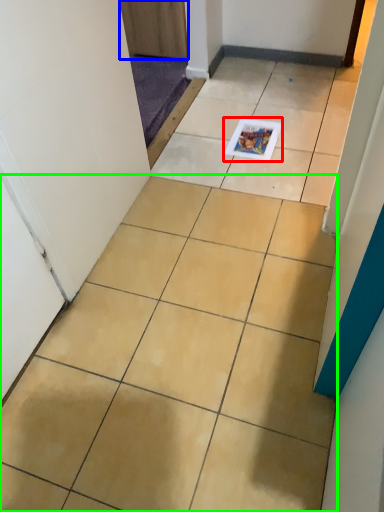
Question: Which object is positioned farthest from magazine (highlighted by a red box)? Select from door (highlighted by a blue box) and ceramic tile (highlighted by a green box).

Choices:
 (A) door
 (B) ceramic tile

Answer: (B)